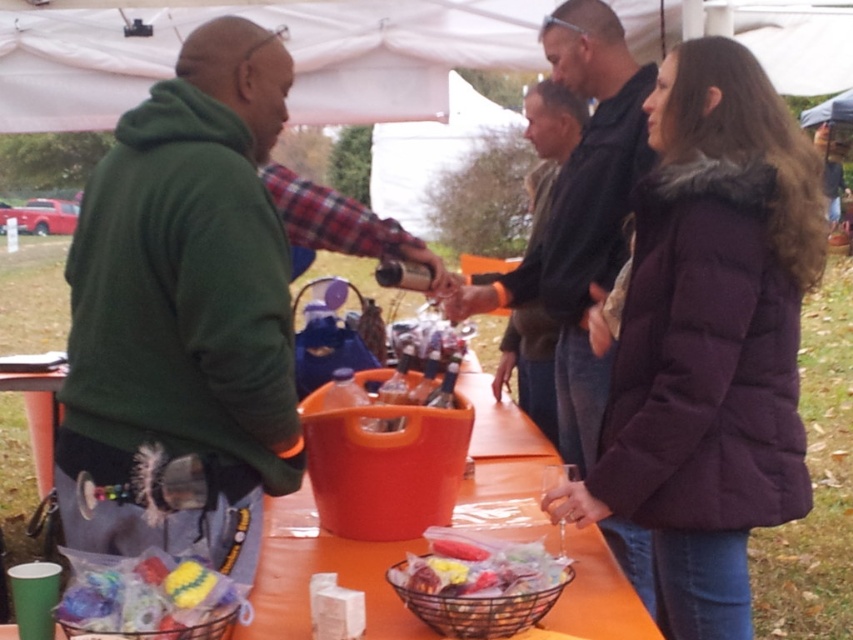
Is point (71, 289) positioned in front of point (633, 278)?

Yes, point (71, 289) is closer to viewer.

Does point (149, 138) lie in front of point (718, 243)?

Yes, point (149, 138) is in front of point (718, 243).

Find the location of a particular element. green fleece jacket at left is located at coordinates (184, 308).

Which is below, brightly colored sponges at lower left or metallic wire basket at lower center?

metallic wire basket at lower center

Which is more to the right, brightly colored sponges at lower left or metallic wire basket at lower center?

metallic wire basket at lower center

Identify the location of brightly colored sponges at lower left. (148, 596).

Is dark gray sweater at center bigger than brightly colored sponges at lower left?

Correct, dark gray sweater at center is larger in size than brightly colored sponges at lower left.

Where is `dark gray sweater at center`? dark gray sweater at center is located at coordinates (589, 205).

Who is more forward, (631, 531) or (112, 612)?

Point (112, 612)

Image resolution: width=853 pixels, height=640 pixels. Identify the location of dark gray sweater at center. (589, 205).